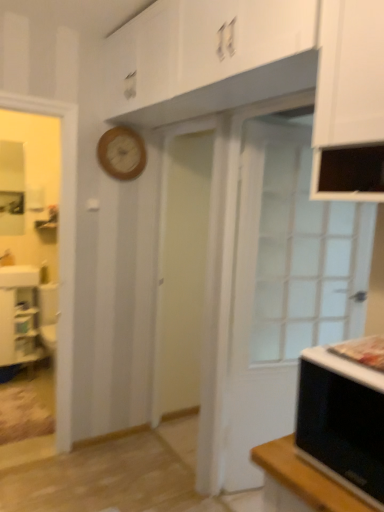
Question: Is white glossy cabinet at lower left positioned before white glass door at right?

Choices:
 (A) no
 (B) yes

Answer: (A)

Question: Considering the relative sizes of white glossy cabinet at lower left and white glass door at right in the image provided, is white glossy cabinet at lower left shorter than white glass door at right?

Choices:
 (A) no
 (B) yes

Answer: (B)

Question: Is white glossy cabinet at lower left placed right next to white glass door at right?

Choices:
 (A) yes
 (B) no

Answer: (B)

Question: Can you confirm if white glossy cabinet at lower left is positioned to the left of white glass door at right?

Choices:
 (A) no
 (B) yes

Answer: (B)

Question: Is white glossy cabinet at lower left positioned with its back to white glass door at right?

Choices:
 (A) no
 (B) yes

Answer: (A)

Question: From the image's perspective, is white glossy cabinet at lower left over white glass door at right?

Choices:
 (A) no
 (B) yes

Answer: (A)

Question: From the image's perspective, is black matte microwave oven at lower right below white glass door at right?

Choices:
 (A) no
 (B) yes

Answer: (B)

Question: Is black matte microwave oven at lower right to the right of white glass door at right from the viewer's perspective?

Choices:
 (A) yes
 (B) no

Answer: (B)

Question: From the image's perspective, would you say black matte microwave oven at lower right is positioned over white glass door at right?

Choices:
 (A) yes
 (B) no

Answer: (B)

Question: Considering the relative sizes of black matte microwave oven at lower right and white glass door at right in the image provided, is black matte microwave oven at lower right smaller than white glass door at right?

Choices:
 (A) no
 (B) yes

Answer: (B)

Question: Is black matte microwave oven at lower right facing towards white glass door at right?

Choices:
 (A) no
 (B) yes

Answer: (A)

Question: Is black matte microwave oven at lower right at the left side of white glass door at right?

Choices:
 (A) no
 (B) yes

Answer: (B)

Question: Is white glass door at right shorter than white glossy cabinet at lower left?

Choices:
 (A) yes
 (B) no

Answer: (B)